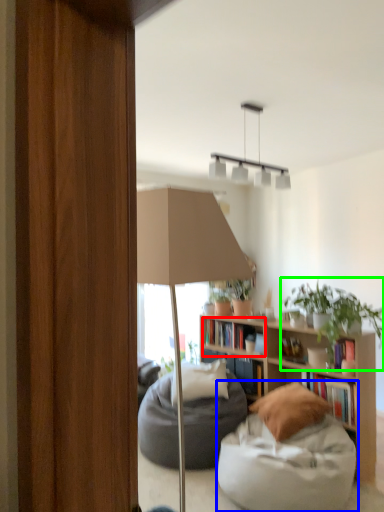
Question: Based on their relative distances, which object is farther from book (highlighted by a red box)? Choose from chair (highlighted by a blue box) and houseplant (highlighted by a green box).

Choices:
 (A) chair
 (B) houseplant

Answer: (A)